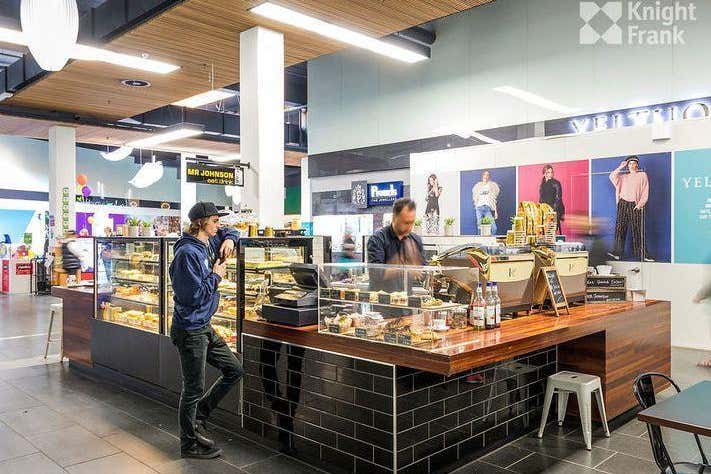
Find the location of a particular element. The height and width of the screenshot is (474, 711). cash register is located at coordinates (304, 272).